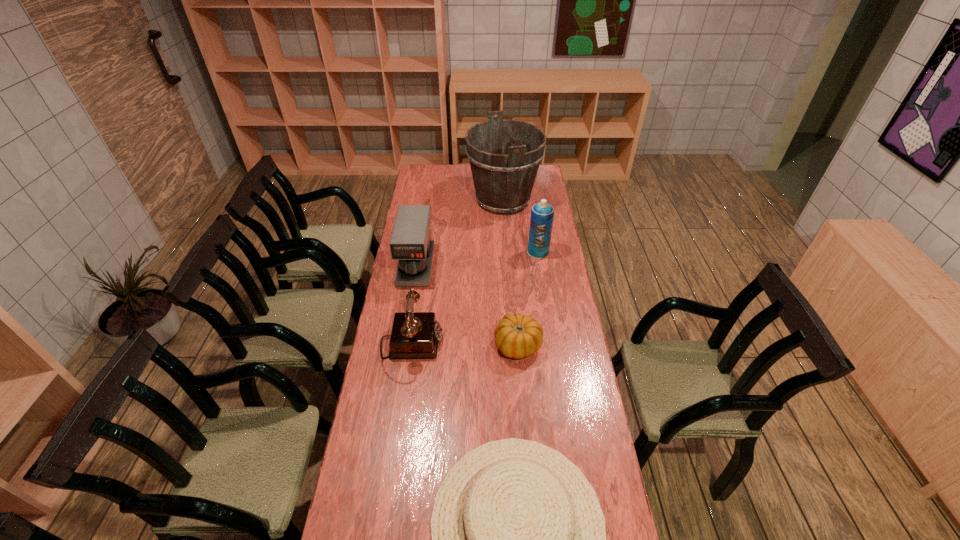
Find the location of a particular element. This screenshot has height=540, width=960. the farthest object is located at coordinates (504, 155).

At what (x,y) coordinates should I click in order to perform the action: click on bucket. Please return your answer as a coordinate pair (x, y). Image resolution: width=960 pixels, height=540 pixels. Looking at the image, I should click on (504, 155).

I want to click on the fifth shortest object, so click(542, 214).

Locate an element on the screen. This screenshot has height=540, width=960. the third tallest object is located at coordinates (410, 243).

Where is `telephone`? telephone is located at coordinates (415, 335).

You are a GUI agent. You are given a task and a screenshot of the screen. Output one action in this format:
    pyautogui.click(x=<x>, y=<y>)
    Task: Click on the fifth tallest object
    Image resolution: width=960 pixels, height=540 pixels.
    Given the screenshot: What is the action you would take?
    pyautogui.click(x=517, y=336)

Where is `blank space located 0.210m on the left of the bucket`? blank space located 0.210m on the left of the bucket is located at coordinates (428, 200).

Where is `free spot located 0.160m on the front of the aerosol can`? The width and height of the screenshot is (960, 540). free spot located 0.160m on the front of the aerosol can is located at coordinates (542, 282).

Where is `vacant space located on the carafe side of the fourth shortest object`? vacant space located on the carafe side of the fourth shortest object is located at coordinates (402, 351).

This screenshot has width=960, height=540. I want to click on vacant space located 0.360m on the dial of the telephone, so click(535, 345).